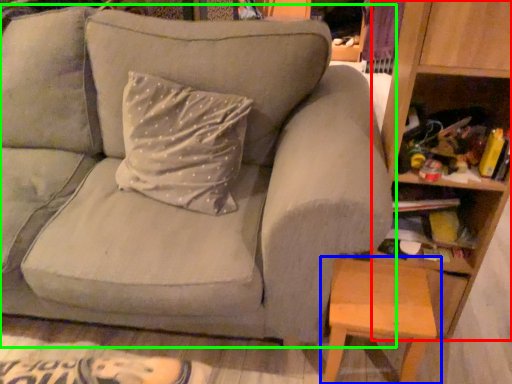
Question: Estimate the real-world distances between objects in this image. Which object is closer to bookshelf (highlighted by a red box), table (highlighted by a blue box) or studio couch (highlighted by a green box)?

Choices:
 (A) table
 (B) studio couch

Answer: (A)